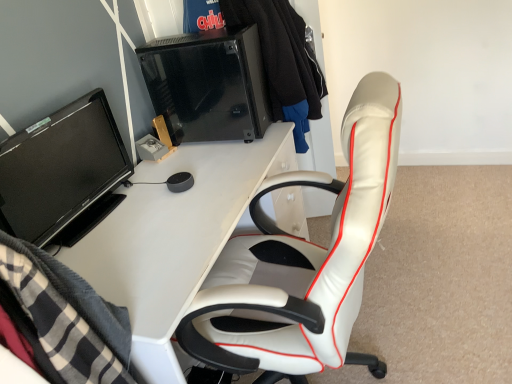
Identify the location of free spot in front of black glossy monitor at left. coord(117,252).